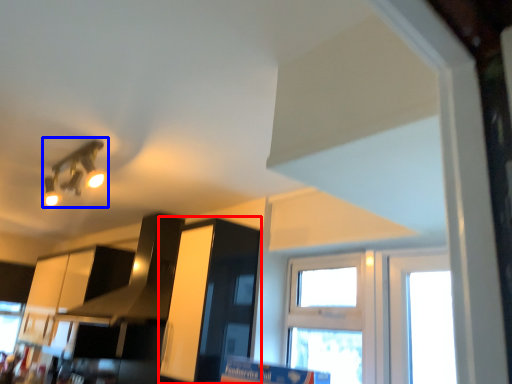
Question: Which object appears farthest to the camera in this image, cabinetry (highlighted by a red box) or light fixture (highlighted by a blue box)?

Choices:
 (A) cabinetry
 (B) light fixture

Answer: (A)